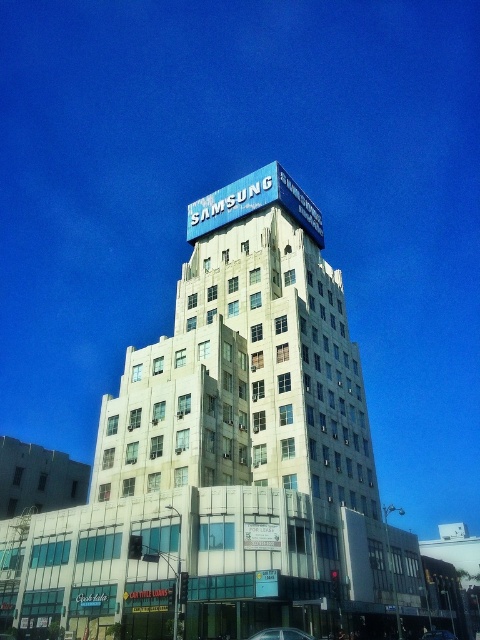
You are a delivery person who needs to park your van between the shiny silver car at center and the shiny blue car at center. The van is 6 meters long. Is there enough space between them to park your van?

The distance between the shiny silver car at center and the shiny blue car at center is 23.67 meters. Since the van is only 6 meters long, there is more than enough space to park between them.

You are standing in front of the white glass building at center and want to park your shiny blue car at center. Can the car fit in front of the building without overlapping?

The white glass building at center is wider than the shiny blue car at center, so the car can fit in front of the building without overlapping.

You are standing in front of the white glass building at center and the shiny silver car at center. Which object is wider?

The white glass building at center is wider than the shiny silver car at center.